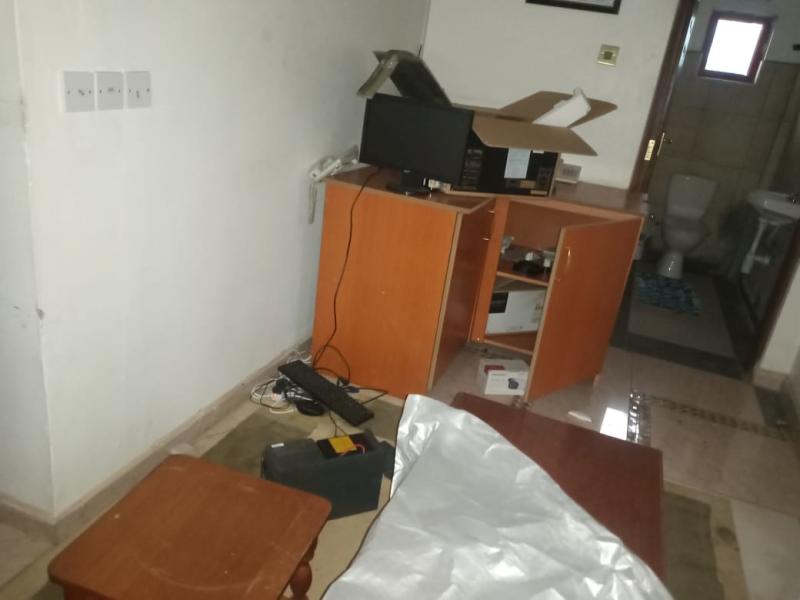
Where is `window`? This screenshot has width=800, height=600. window is located at coordinates (726, 66).